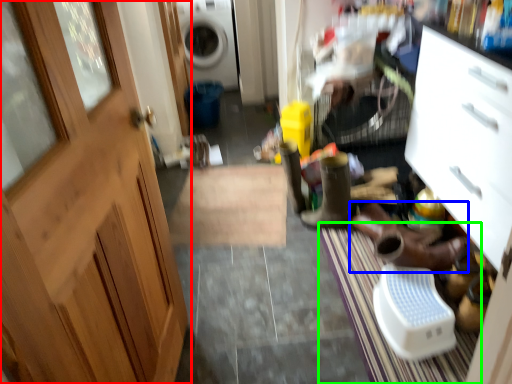
Question: Which object is positioned farthest from door (highlighted by a red box)? Select from footwear (highlighted by a blue box) and doormat (highlighted by a green box).

Choices:
 (A) footwear
 (B) doormat

Answer: (A)